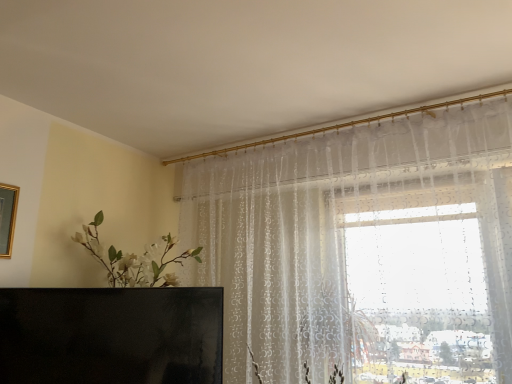
Question: Considering the relative sizes of black glossy tv at lower left and gold-framed mirror at upper left in the image provided, is black glossy tv at lower left thinner than gold-framed mirror at upper left?

Choices:
 (A) yes
 (B) no

Answer: (B)

Question: From a real-world perspective, does black glossy tv at lower left stand above gold-framed mirror at upper left?

Choices:
 (A) yes
 (B) no

Answer: (B)

Question: Can you confirm if black glossy tv at lower left is smaller than gold-framed mirror at upper left?

Choices:
 (A) yes
 (B) no

Answer: (B)

Question: Is black glossy tv at lower left positioned behind gold-framed mirror at upper left?

Choices:
 (A) yes
 (B) no

Answer: (B)

Question: Is black glossy tv at lower left at the right side of gold-framed mirror at upper left?

Choices:
 (A) yes
 (B) no

Answer: (A)

Question: From a real-world perspective, is black glossy tv at lower left located beneath gold-framed mirror at upper left?

Choices:
 (A) yes
 (B) no

Answer: (A)

Question: Is the depth of gold-framed mirror at upper left greater than that of black glossy tv at lower left?

Choices:
 (A) no
 (B) yes

Answer: (B)

Question: Is gold-framed mirror at upper left at the left side of black glossy tv at lower left?

Choices:
 (A) no
 (B) yes

Answer: (B)

Question: Is gold-framed mirror at upper left to the right of black glossy tv at lower left from the viewer's perspective?

Choices:
 (A) no
 (B) yes

Answer: (A)

Question: Could you tell me if gold-framed mirror at upper left is facing black glossy tv at lower left?

Choices:
 (A) yes
 (B) no

Answer: (B)

Question: Is gold-framed mirror at upper left not within black glossy tv at lower left?

Choices:
 (A) no
 (B) yes

Answer: (B)

Question: From the image's perspective, is gold-framed mirror at upper left under black glossy tv at lower left?

Choices:
 (A) no
 (B) yes

Answer: (A)

Question: From the image's perspective, is gold-framed mirror at upper left located above or below black glossy tv at lower left?

Choices:
 (A) above
 (B) below

Answer: (A)